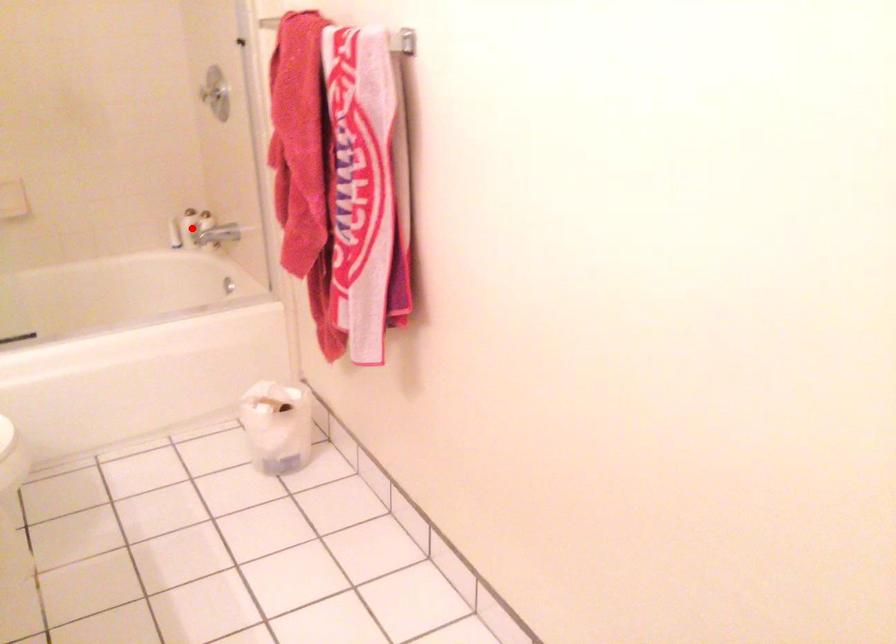
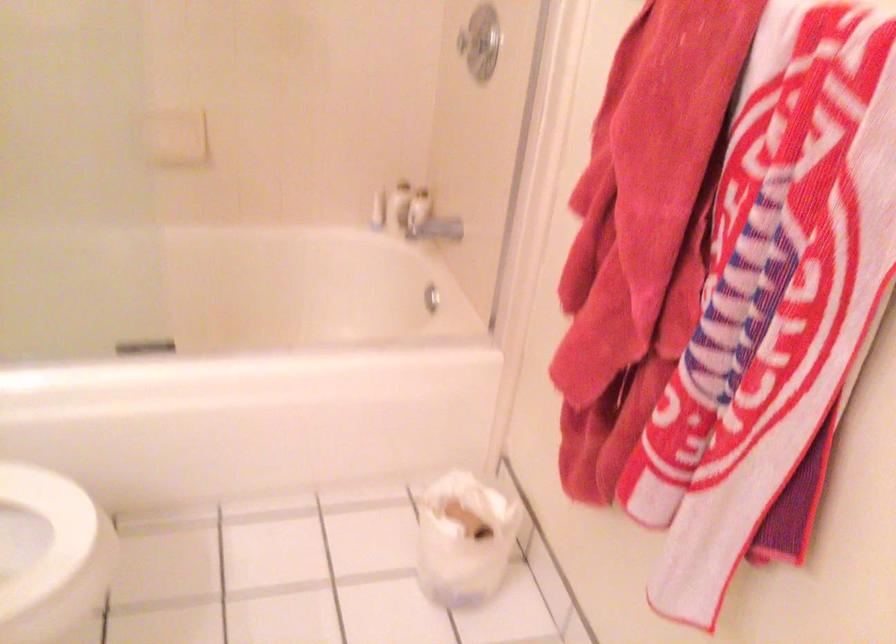
Locate, in the second image, the point that corresponds to the highlighted location in the first image.

(399, 205)